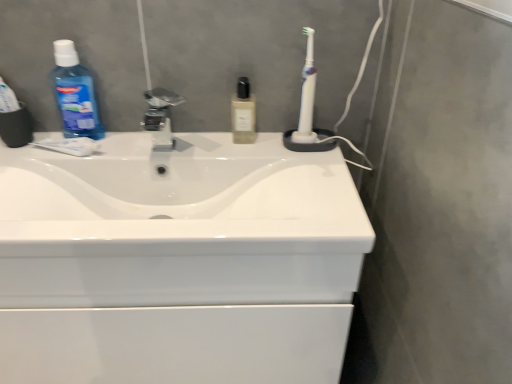
Locate an element on the screen. Image resolution: width=512 pixels, height=384 pixels. free space to the left of white plastic toothbrush at upper right is located at coordinates (244, 142).